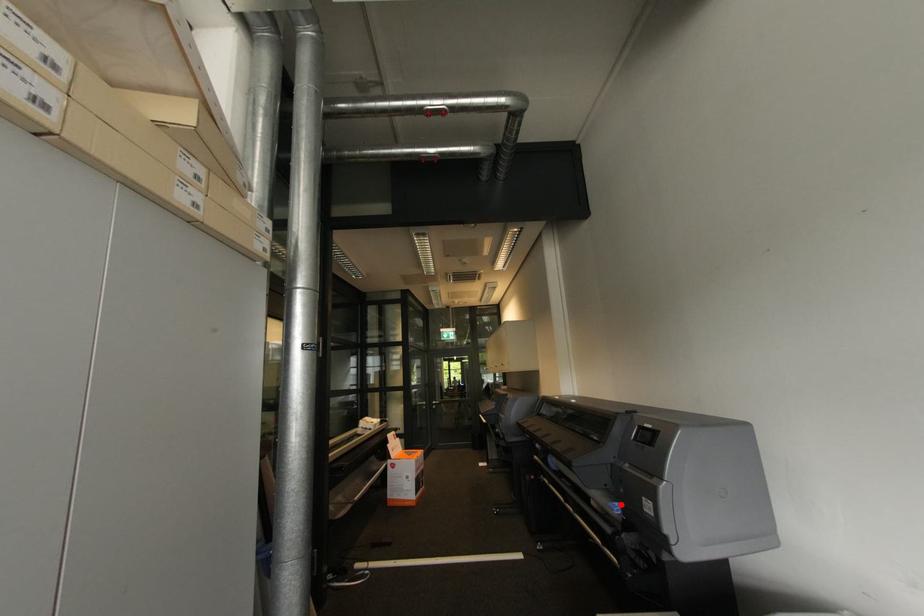
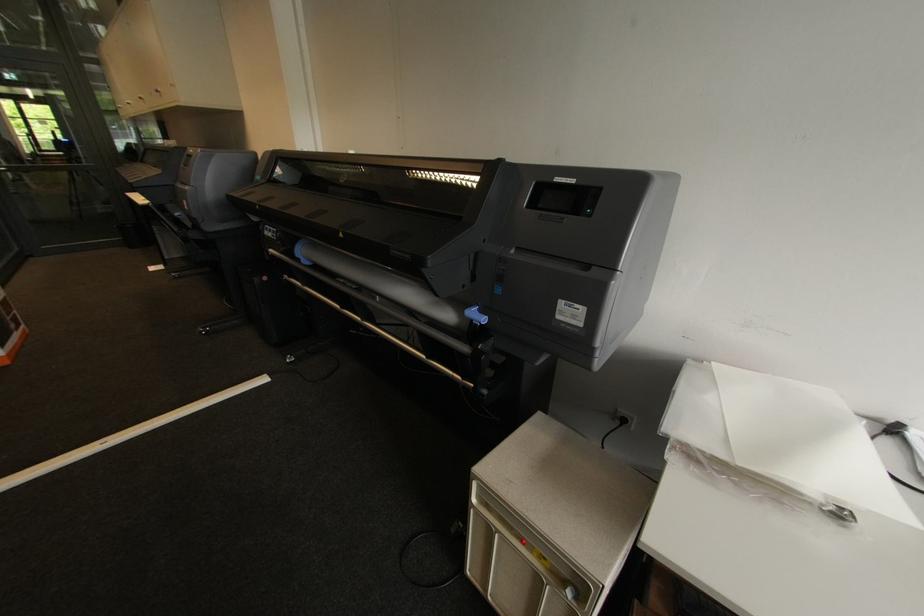
The point at the highlighted location is marked in the first image. Where is the corresponding point in the second image?

(479, 310)